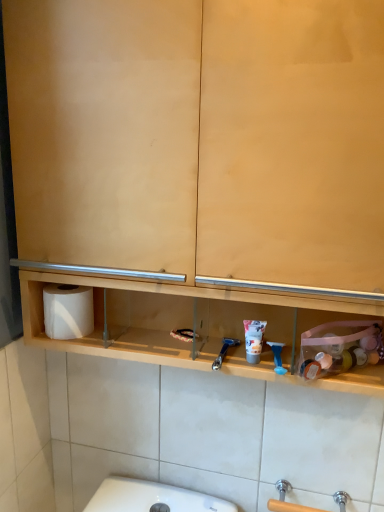
Question: Does blue plastic razor at center, the first shower viewed from the left, have a larger size compared to blue plastic razor at center, arranged as the 2th shower when viewed from the left?

Choices:
 (A) yes
 (B) no

Answer: (B)

Question: From the image's perspective, is blue plastic razor at center, which is the 2th shower in right-to-left order, located beneath blue plastic razor at center, marked as the first shower in a right-to-left arrangement?

Choices:
 (A) yes
 (B) no

Answer: (B)

Question: Is blue plastic razor at center, the first shower viewed from the left, further to camera compared to blue plastic razor at center, arranged as the 2th shower when viewed from the left?

Choices:
 (A) no
 (B) yes

Answer: (B)

Question: Does blue plastic razor at center, which is the 2th shower in right-to-left order, have a lesser width compared to blue plastic razor at center, arranged as the 2th shower when viewed from the left?

Choices:
 (A) no
 (B) yes

Answer: (A)

Question: Can you confirm if blue plastic razor at center, the first shower viewed from the left, is smaller than blue plastic razor at center, arranged as the 2th shower when viewed from the left?

Choices:
 (A) no
 (B) yes

Answer: (B)

Question: Considering the relative sizes of blue plastic razor at center, which is the 2th shower in right-to-left order, and blue plastic razor at center, marked as the first shower in a right-to-left arrangement, in the image provided, is blue plastic razor at center, which is the 2th shower in right-to-left order, wider than blue plastic razor at center, marked as the first shower in a right-to-left arrangement,?

Choices:
 (A) yes
 (B) no

Answer: (A)

Question: Is white matte toilet paper at left taller than blue plastic razor at center, marked as the first shower in a right-to-left arrangement?

Choices:
 (A) no
 (B) yes

Answer: (B)

Question: Can you confirm if white matte toilet paper at left is wider than blue plastic razor at center, arranged as the 2th shower when viewed from the left?

Choices:
 (A) no
 (B) yes

Answer: (B)

Question: From a real-world perspective, does white matte toilet paper at left sit lower than blue plastic razor at center, arranged as the 2th shower when viewed from the left?

Choices:
 (A) yes
 (B) no

Answer: (B)

Question: Is white matte toilet paper at left not near blue plastic razor at center, arranged as the 2th shower when viewed from the left?

Choices:
 (A) yes
 (B) no

Answer: (B)

Question: From a real-world perspective, is white matte toilet paper at left on blue plastic razor at center, arranged as the 2th shower when viewed from the left?

Choices:
 (A) yes
 (B) no

Answer: (A)

Question: Is blue plastic razor at center, marked as the first shower in a right-to-left arrangement, completely or partially inside white matte toilet paper at left?

Choices:
 (A) no
 (B) yes

Answer: (A)

Question: Does blue plastic razor at center, the first shower viewed from the left, have a larger size compared to white matte toilet paper at left?

Choices:
 (A) no
 (B) yes

Answer: (A)